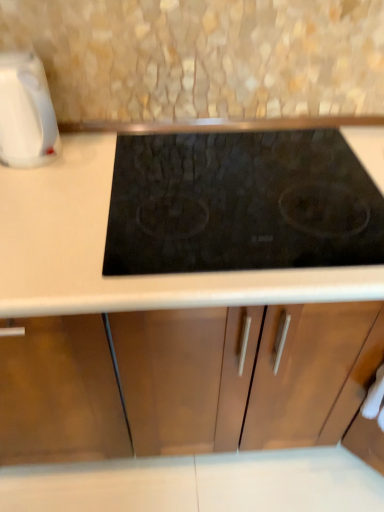
Find the location of `vacant point above black glass cooktop at center (from a real-world perspective)`. vacant point above black glass cooktop at center (from a real-world perspective) is located at coordinates (255, 184).